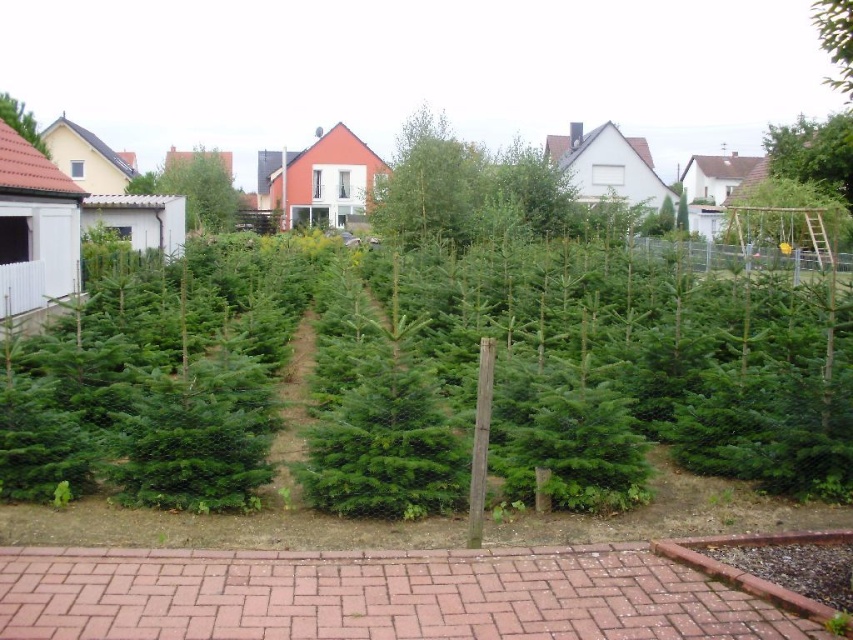
Looking at this image, you are a customer at the Christmas tree farm and want to buy a tree. You see two trees at the upper right corner of the image, a green leafy tree at upper right and a green matte tree at upper right. Which one is more to the right?

The green leafy tree at upper right is positioned on the right side of green matte tree at upper right, so the green leafy tree at upper right is more to the right.